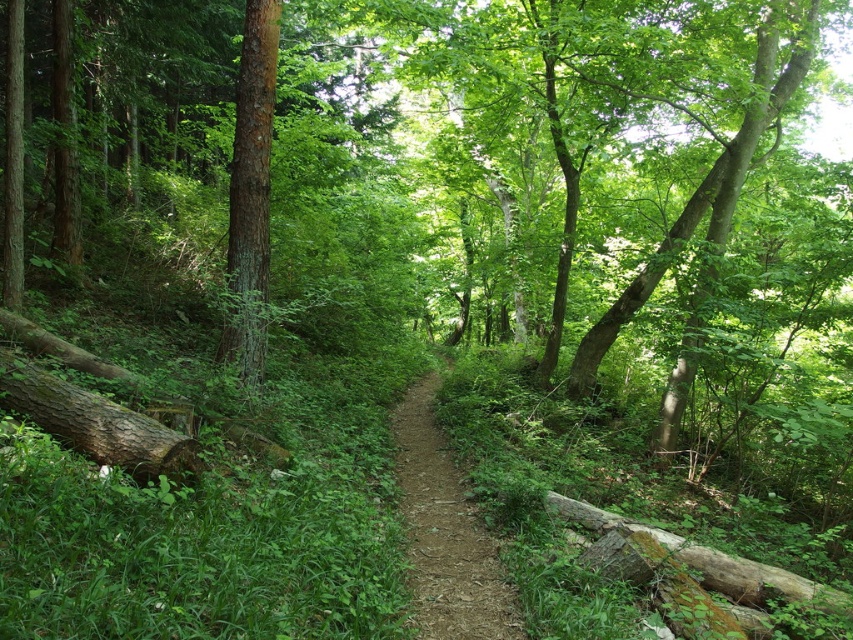
Who is positioned more to the left, dirt path at center or smooth brown tree trunk at center-left?

From the viewer's perspective, smooth brown tree trunk at center-left appears more on the left side.

Can you confirm if dirt path at center is positioned to the right of smooth brown tree trunk at center-left?

Indeed, dirt path at center is positioned on the right side of smooth brown tree trunk at center-left.

Is point (468, 534) less distant than point (233, 353)?

That is True.

The width and height of the screenshot is (853, 640). What are the coordinates of `dirt path at center` in the screenshot? It's located at (445, 532).